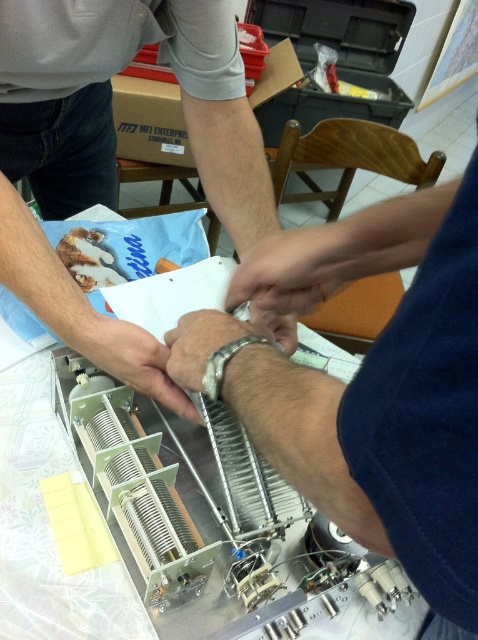
You are a worker in a workshop and need to place the white matte hand at center into a storage box that is 50 centimeters wide. Will the hand fit?

The white matte hand at center is 51.18 centimeters in width, which is slightly wider than the 50 centimeter storage box. Therefore, it will not fit inside the box.

You are a technician working on a delicate electronic component. Your hands are positioned at the center of the workspace. You need to reach for a tool located near your sleek silver wristwatch at center without moving your white matte hand at center. Can you do this?

The distance between the white matte hand at center and the sleek silver wristwatch at center is 5.78 inches, so yes, you can reach the tool near the sleek silver wristwatch at center without moving the white matte hand at center since the distance allows for such movement.

You are a jeweler who needs to place both the metallic silver wristwatch at center and the silver metallic bracelet at center into a display case. The display case has a divider that can only separate items by at least 3 inches. Can you fit both items into the display case without them touching?

The metallic silver wristwatch at center is 3.09 inches away from the silver metallic bracelet at center. Since the divider requires at least 3 inches of separation, the 3.09 inches distance meets the requirement. Therefore, both items can be placed in the display case without touching.